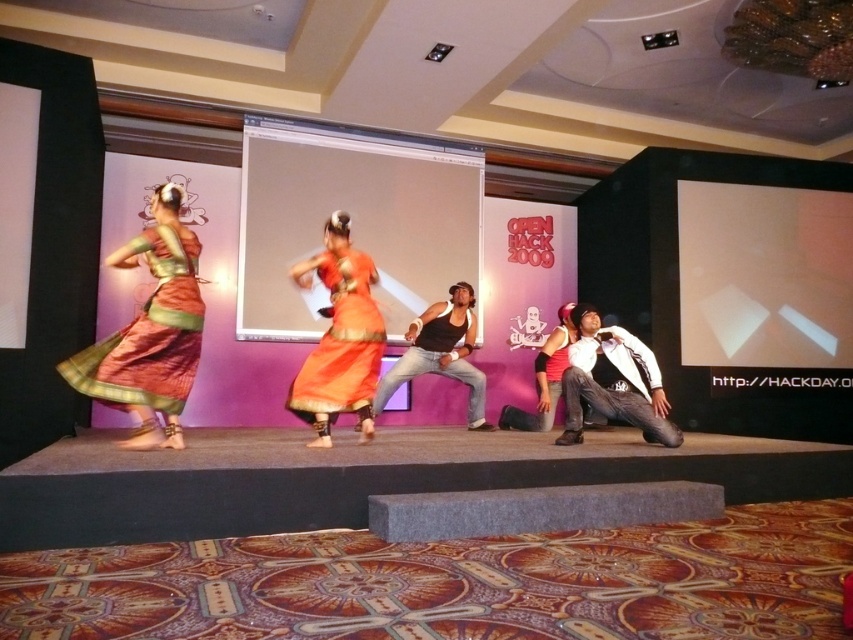
Who is positioned more to the left, silky orange saree at left or white matte jacket at lower right?

silky orange saree at left

Who is taller, silky orange saree at left or white matte jacket at lower right?

With more height is silky orange saree at left.

Where is `silky orange saree at left`? This screenshot has height=640, width=853. silky orange saree at left is located at coordinates (149, 333).

Is point (195, 346) closer to viewer compared to point (288, 397)?

Yes, point (195, 346) is in front of point (288, 397).

Is silky orange saree at left to the right of orange silk dress at center from the viewer's perspective?

In fact, silky orange saree at left is to the left of orange silk dress at center.

Find the location of `silky orange saree at left`. silky orange saree at left is located at coordinates (149, 333).

At what (x,y) coordinates should I click in order to perform the action: click on orange silk dress at center. Please return your answer as a coordinate pair (x, y). Looking at the image, I should click on (341, 340).

Is orange silk dress at center to the left of white matte jacket at lower right from the viewer's perspective?

Indeed, orange silk dress at center is positioned on the left side of white matte jacket at lower right.

Between point (314, 401) and point (558, 440), which one is positioned behind?

The point (558, 440) is behind.

Where is `orange silk dress at center`? orange silk dress at center is located at coordinates (341, 340).